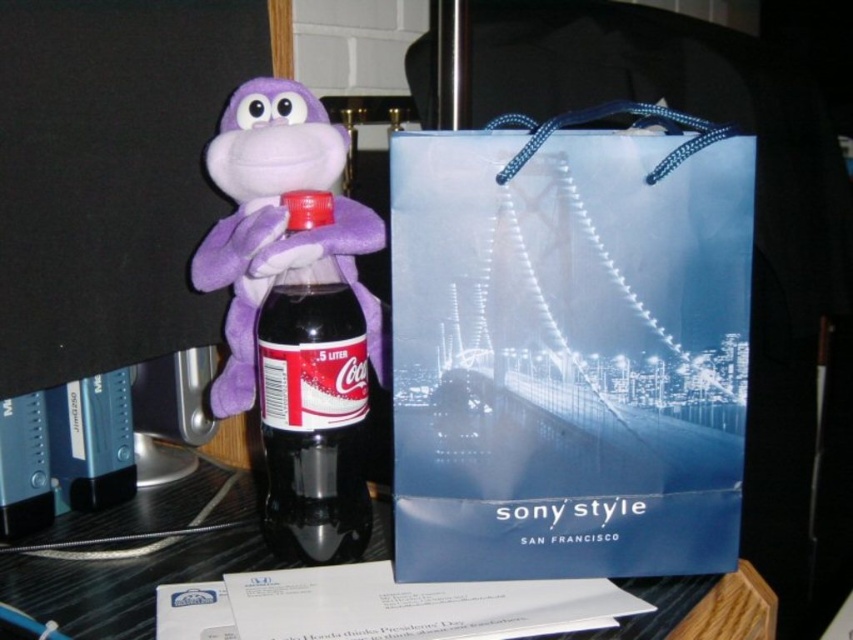
Question: Which of the following is the farthest from the observer?

Choices:
 (A) black glossy table at center
 (B) matte plastic bottle at center

Answer: (B)

Question: Does black glossy table at center appear under purple plush monkey at center?

Choices:
 (A) yes
 (B) no

Answer: (A)

Question: Is blue paper bag at center bigger than purple plush monkey at center?

Choices:
 (A) yes
 (B) no

Answer: (B)

Question: Is blue paper bag at center to the left of matte plastic bottle at center from the viewer's perspective?

Choices:
 (A) yes
 (B) no

Answer: (B)

Question: Which point is farther to the camera?

Choices:
 (A) black glossy table at center
 (B) matte plastic bottle at center

Answer: (B)

Question: Which object is positioned farthest from the blue paper bag at center?

Choices:
 (A) matte plastic bottle at center
 (B) purple plush monkey at center
 (C) black glossy table at center

Answer: (C)